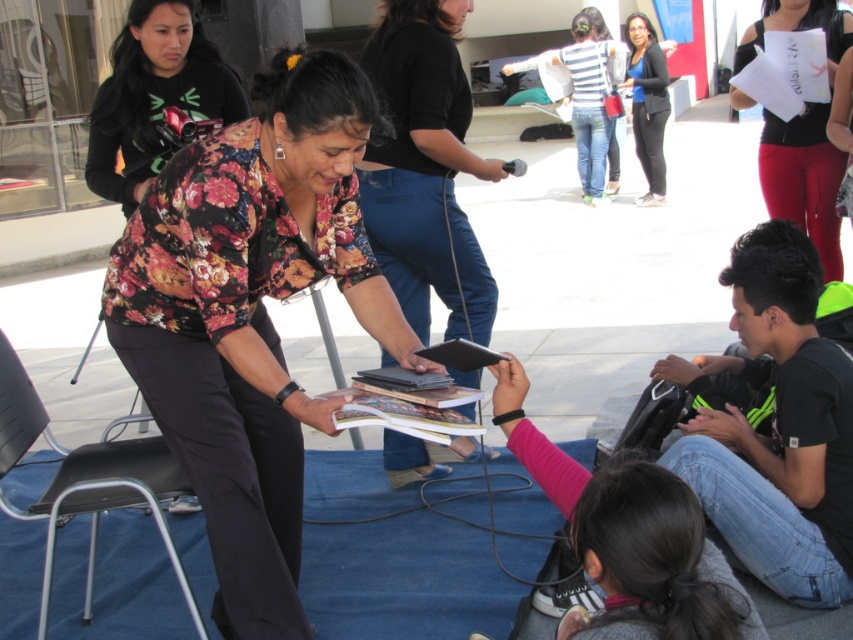
Question: Which point is closer to the camera?

Choices:
 (A) (99, 122)
 (B) (653, 80)

Answer: (A)

Question: Can you confirm if black plastic chair at lower left is positioned above striped fabric shirt at upper center?

Choices:
 (A) yes
 (B) no

Answer: (B)

Question: Can you confirm if black plastic chair at lower left is smaller than pink fleece sweater at lower center?

Choices:
 (A) no
 (B) yes

Answer: (A)

Question: Among these objects, which one is nearest to the camera?

Choices:
 (A) striped fabric shirt at upper center
 (B) pink fleece sweater at lower center
 (C) black jersey at upper right
 (D) black plastic chair at lower left

Answer: (B)

Question: Among these points, which one is nearest to the camera?

Choices:
 (A) (187, 84)
 (B) (645, 138)
 (C) (302, 417)

Answer: (C)

Question: Is the position of floral fabric shirt at center more distant than that of matte black shirt at upper right?

Choices:
 (A) no
 (B) yes

Answer: (A)